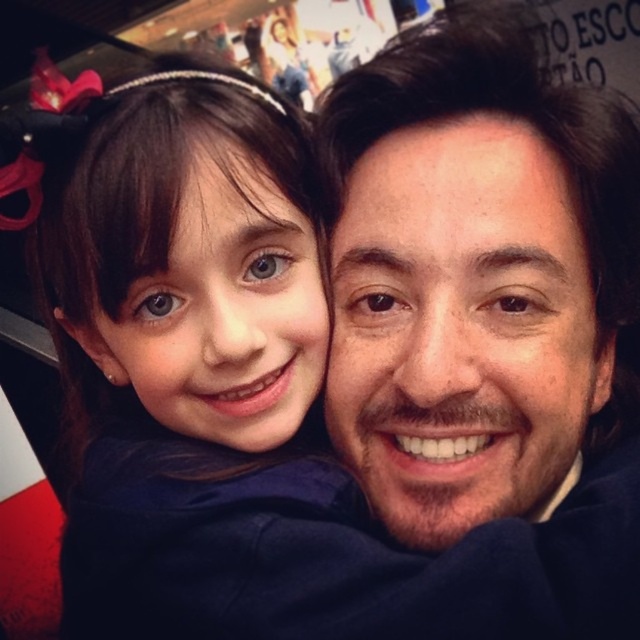
Question: Among these points, which one is nearest to the camera?

Choices:
 (A) (168, 253)
 (B) (264, 35)

Answer: (A)

Question: Can you confirm if matte blue dress at center is wider than matte plastic photo frame at upper center?

Choices:
 (A) no
 (B) yes

Answer: (B)

Question: In this image, where is matte blue dress at center located relative to matte plastic photo frame at upper center?

Choices:
 (A) right
 (B) left

Answer: (A)

Question: Which point is farther from the camera taking this photo?

Choices:
 (A) (60, 132)
 (B) (282, 60)

Answer: (B)

Question: Does matte blue dress at center have a smaller size compared to matte plastic photo frame at upper center?

Choices:
 (A) no
 (B) yes

Answer: (A)